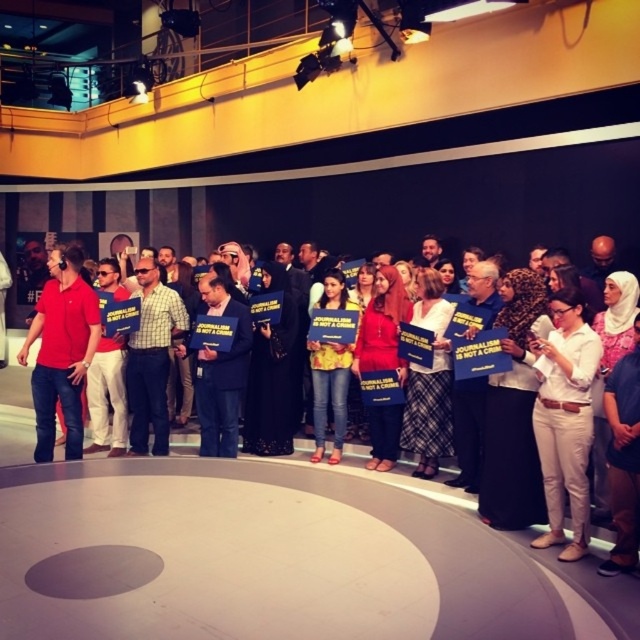
You are organizing a press conference and need to determine the visibility of two items from the audience. Which item would be more noticeable to someone sitting in the front row? The matte red polo shirt at left or the matte blue folder at center?

The matte red polo shirt at left is larger in size than the matte blue folder at center, so it would be more noticeable to someone sitting in the front row.

You are a photographer taking a picture of the scene. You notice the white cotton pants at lower right and the matte red polo shirt at left. Which clothing item is shorter in height?

The white cotton pants at lower right is shorter than the matte red polo shirt at left.

You are a photographer positioned at the back of the room. You need to capture a photo of the matte blue folder at center without the white cotton pants at lower right blocking it. Is this possible given their positions?

The white cotton pants at lower right is located above the matte blue folder at center, so the white cotton pants at lower right would block the view of the matte blue folder at center. Therefore, it is not possible to capture the matte blue folder at center without obstruction from the white cotton pants at lower right.